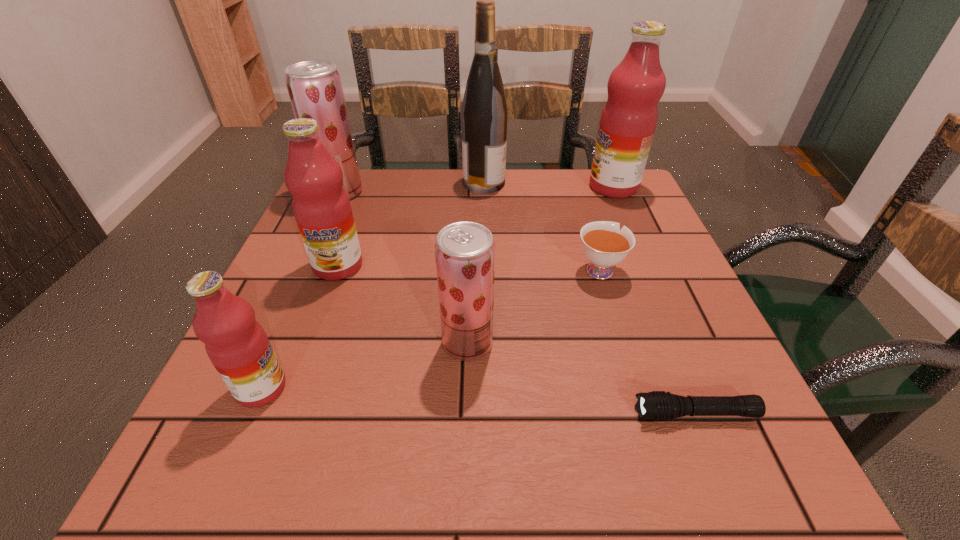
Identify which fruit juice is located as the nearest to the third farthest fruit juice. Please provide its 2D coordinates. Your answer should be formatted as a tuple, i.e. [(x, y)], where the tuple contains the x and y coordinates of a point satisfying the conditions above.

[(314, 86)]

Identify which fruit juice is the fourth nearest to the rightmost pink fruit juice. Please provide its 2D coordinates. Your answer should be formatted as a tuple, i.e. [(x, y)], where the tuple contains the x and y coordinates of a point satisfying the conditions above.

[(236, 344)]

Where is `pink fruit juice identified as the second closest to the rightmost fruit juice`? pink fruit juice identified as the second closest to the rightmost fruit juice is located at coordinates (236, 344).

Select which pink fruit juice is the second closest to the rightmost fruit juice. Please provide its 2D coordinates. Your answer should be formatted as a tuple, i.e. [(x, y)], where the tuple contains the x and y coordinates of a point satisfying the conditions above.

[(236, 344)]

You are a GUI agent. You are given a task and a screenshot of the screen. Output one action in this format:
    pyautogui.click(x=<x>, y=<y>)
    Task: Click on the vacant space that satisfies the following two spatial constraints: 1. on the label of the smaller strawberry fruit juice; 2. on the right side of the second farthest pink fruit juice
    The width and height of the screenshot is (960, 540).
    Given the screenshot: What is the action you would take?
    pyautogui.click(x=310, y=343)

The height and width of the screenshot is (540, 960). What are the coordinates of `free space in the image that satisfies the following two spatial constraints: 1. on the label of the rightmost pink fruit juice; 2. on the front side of the second nearest fruit juice` in the screenshot? It's located at (682, 343).

Identify the location of free region that satisfies the following two spatial constraints: 1. on the label of the third farthest fruit juice; 2. on the label of the smallest pink fruit juice. (294, 388).

In order to click on free space that satisfies the following two spatial constraints: 1. on the label of the second smallest pink fruit juice; 2. on the label of the smallest pink fruit juice in this screenshot , I will do `click(294, 388)`.